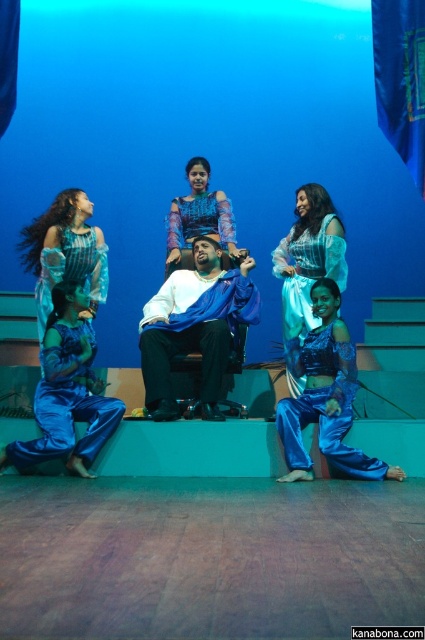
Does blue fabric draped at center have a smaller size compared to blue satin dress at lower left?

Actually, blue fabric draped at center might be larger than blue satin dress at lower left.

Does blue fabric draped at center have a greater height compared to blue satin dress at lower left?

Yes.

Locate an element on the screen. blue fabric draped at center is located at coordinates (195, 326).

I want to click on blue fabric draped at center, so click(195, 326).

Is point (297, 465) more distant than point (286, 276)?

No.

Can you confirm if shiny blue fabric at lower right is smaller than matte blue dress at center?

Yes.

Does point (322, 392) come farther from viewer compared to point (303, 314)?

No, (322, 392) is closer to viewer.

Where is `shiny blue fabric at lower right`? Image resolution: width=425 pixels, height=640 pixels. shiny blue fabric at lower right is located at coordinates (325, 408).

Is blue satin pants at lower left to the left of matte blue dress at center from the viewer's perspective?

Yes, blue satin pants at lower left is to the left of matte blue dress at center.

Who is more forward, [50,381] or [305,248]?

Point [50,381] is in front.

Between point (53, 355) and point (317, 220), which one is positioned behind?

Point (317, 220)

Find the location of `blue satin pants at lower left`. blue satin pants at lower left is located at coordinates (68, 401).